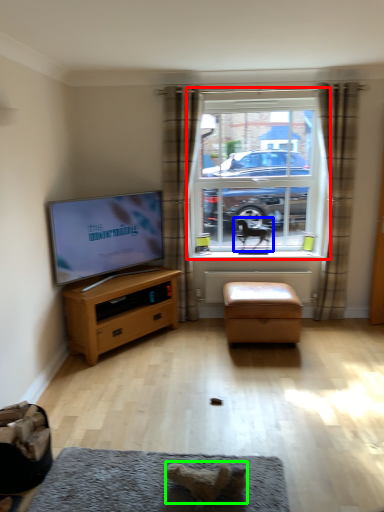
Question: Considering the real-world distances, which object is closest to window (highlighted by a red box)? animal (highlighted by a blue box) or animal (highlighted by a green box).

Choices:
 (A) animal
 (B) animal

Answer: (A)